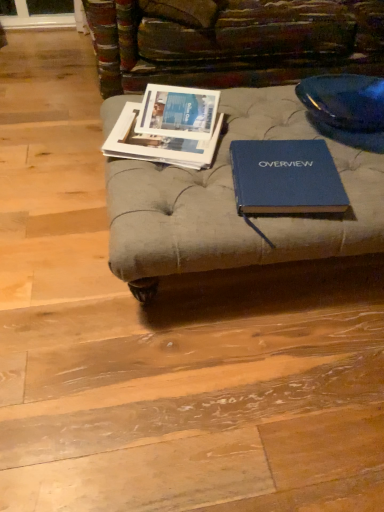
Question: Considering the positions of matte paper magazine at center and matte paper magazines at center left, the 1th book in the left-to-right sequence, in the image, is matte paper magazine at center taller or shorter than matte paper magazines at center left, the 1th book in the left-to-right sequence,?

Choices:
 (A) tall
 (B) short

Answer: (A)

Question: Considering their positions, is matte paper magazine at center located in front of or behind matte paper magazines at center left, placed as the 2th book when sorted from right to left?

Choices:
 (A) front
 (B) behind

Answer: (B)

Question: Estimate the real-world distances between objects in this image. Which object is closer to the blue hardcover book at center, the second book viewed from the left?

Choices:
 (A) matte paper magazines at center left, the 1th book in the left-to-right sequence
 (B) matte paper magazine at center

Answer: (A)

Question: Which is farther from the matte paper magazines at center left, the 1th book in the left-to-right sequence?

Choices:
 (A) matte paper magazine at center
 (B) blue hardcover book at center, the second book viewed from the left

Answer: (B)